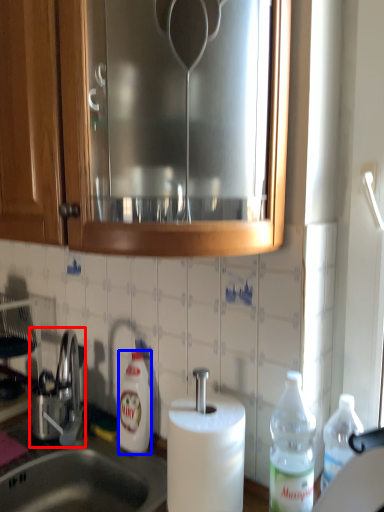
Question: Which object is closer to the camera taking this photo, tap (highlighted by a red box) or bottle (highlighted by a blue box)?

Choices:
 (A) tap
 (B) bottle

Answer: (B)